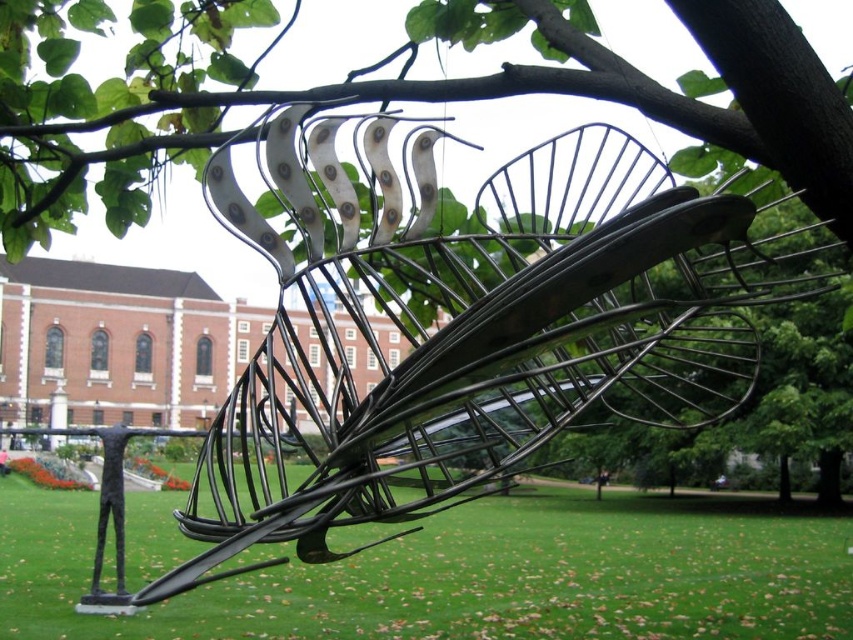
Image resolution: width=853 pixels, height=640 pixels. What do you see at coordinates (463, 326) in the screenshot? I see `black wire sculpture at center` at bounding box center [463, 326].

Which of these two, black wire sculpture at center or green grass at lower center, stands shorter?

Standing shorter between the two is green grass at lower center.

Looking at this image, who is more forward, (498, 436) or (444, 605)?

Point (498, 436) is in front.

Locate an element on the screen. black wire sculpture at center is located at coordinates (463, 326).